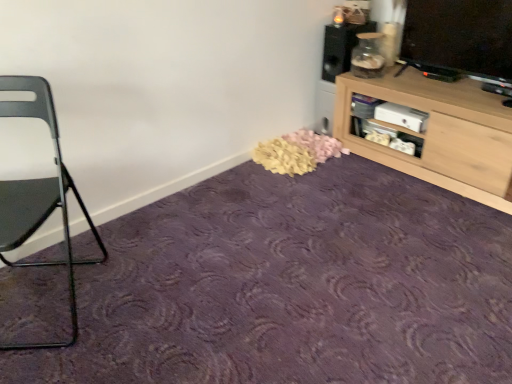
Describe the element at coordinates (294, 286) in the screenshot. The image size is (512, 384). I see `purple carpet at center` at that location.

Image resolution: width=512 pixels, height=384 pixels. Identify the location of matte black speaker at upper right. (341, 47).

Choose the correct answer: Is matte black speaker at upper right inside metallic gray chair at left or outside it?

matte black speaker at upper right is spatially situated outside metallic gray chair at left.

Between matte black speaker at upper right and metallic gray chair at left, which one has smaller size?

matte black speaker at upper right is smaller.

In the image, there is a metallic gray chair at left. Identify the location of speaker above it (from the image's perspective). point(341,47).

From a real-world perspective, is matte black speaker at upper right positioned above or below metallic gray chair at left?

Clearly, from a real-world perspective, matte black speaker at upper right is above metallic gray chair at left.

Is metallic gray chair at left completely or partially outside of purple carpet at center?

That's correct, metallic gray chair at left is outside of purple carpet at center.

Which object is positioned more to the right, metallic gray chair at left or purple carpet at center?

purple carpet at center is more to the right.

What's the angular difference between metallic gray chair at left and purple carpet at center's facing directions?

There is a 128-degree angle between the facing directions of metallic gray chair at left and purple carpet at center.

Which of these two, metallic gray chair at left or purple carpet at center, is bigger?

metallic gray chair at left is bigger.

From a real-world perspective, is metallic gray chair at left positioned over light wood cabinet at upper right based on gravity?

Yes, from a real-world perspective, metallic gray chair at left is above light wood cabinet at upper right.

Find the location of `shelf on the right of metallic gray chair at left`. shelf on the right of metallic gray chair at left is located at coordinates (440, 133).

Does metallic gray chair at left have a lesser width compared to light wood cabinet at upper right?

Indeed, metallic gray chair at left has a lesser width compared to light wood cabinet at upper right.

Is metallic gray chair at left facing away from light wood cabinet at upper right?

No, metallic gray chair at left is not facing the opposite direction of light wood cabinet at upper right.

Is light wood cabinet at upper right not inside matte black speaker at upper right?

Absolutely, light wood cabinet at upper right is external to matte black speaker at upper right.

Can you confirm if light wood cabinet at upper right is shorter than matte black speaker at upper right?

No, light wood cabinet at upper right is not shorter than matte black speaker at upper right.

Considering the sizes of objects light wood cabinet at upper right and matte black speaker at upper right in the image provided, who is bigger, light wood cabinet at upper right or matte black speaker at upper right?

Bigger between the two is light wood cabinet at upper right.

From a real-world perspective, is light wood cabinet at upper right on matte black speaker at upper right?

Incorrect, from a real-world perspective, light wood cabinet at upper right is lower than matte black speaker at upper right.

Which point is more forward, (356, 365) or (498, 120)?

Point (356, 365)

Would you say purple carpet at center is inside or outside light wood cabinet at upper right?

purple carpet at center is not inside light wood cabinet at upper right, it's outside.

In terms of height, does purple carpet at center look taller or shorter compared to light wood cabinet at upper right?

Considering their sizes, purple carpet at center has less height than light wood cabinet at upper right.

Can you tell me how much purple carpet at center and light wood cabinet at upper right differ in facing direction?

They differ by 177 degrees in their facing directions.

Which object is wider, metallic gray chair at left or matte black speaker at upper right?

metallic gray chair at left.

You are a GUI agent. You are given a task and a screenshot of the screen. Output one action in this format:
    pyautogui.click(x=<x>, y=<y>)
    Task: Click on the chair located on the left of matte black speaker at upper right
    
    Given the screenshot: What is the action you would take?
    pyautogui.click(x=39, y=195)

Can you confirm if metallic gray chair at left is positioned to the left of matte black speaker at upper right?

Correct, you'll find metallic gray chair at left to the left of matte black speaker at upper right.

Is metallic gray chair at left oriented towards matte black speaker at upper right?

No.

Is purple carpet at center bigger than matte black speaker at upper right?

Indeed, purple carpet at center has a larger size compared to matte black speaker at upper right.

From a real-world perspective, is purple carpet at center under matte black speaker at upper right?

Correct, in the physical world, purple carpet at center is lower than matte black speaker at upper right.

Considering the sizes of objects purple carpet at center and matte black speaker at upper right in the image provided, who is thinner, purple carpet at center or matte black speaker at upper right?

Thinner between the two is matte black speaker at upper right.

Find the location of a particular element. plain below the matte black speaker at upper right (from the image's perspective) is located at coordinates (294, 286).

What are the coordinates of `speaker lying on the right of metallic gray chair at left` in the screenshot? It's located at (341, 47).

The height and width of the screenshot is (384, 512). Find the location of `chair above the purple carpet at center (from the image's perspective)`. chair above the purple carpet at center (from the image's perspective) is located at coordinates (39, 195).

Which object lies nearer to the anchor point purple carpet at center, metallic gray chair at left or light wood cabinet at upper right?

The object closer to purple carpet at center is metallic gray chair at left.

When comparing their distances from purple carpet at center, does metallic gray chair at left or matte black speaker at upper right seem further?

matte black speaker at upper right lies further to purple carpet at center than the other object.

When comparing their distances from metallic gray chair at left, does purple carpet at center or light wood cabinet at upper right seem further?

light wood cabinet at upper right is further to metallic gray chair at left.

Considering their positions, is matte black speaker at upper right positioned closer to light wood cabinet at upper right than metallic gray chair at left?

Based on the image, matte black speaker at upper right appears to be nearer to light wood cabinet at upper right.

Based on their spatial positions, is matte black speaker at upper right or purple carpet at center further from metallic gray chair at left?

matte black speaker at upper right lies further to metallic gray chair at left than the other object.

Considering their positions, is metallic gray chair at left positioned further to light wood cabinet at upper right than matte black speaker at upper right?

Among the two, metallic gray chair at left is located further to light wood cabinet at upper right.

From the image, which object appears to be nearer to matte black speaker at upper right, light wood cabinet at upper right or metallic gray chair at left?

Among the two, light wood cabinet at upper right is located nearer to matte black speaker at upper right.

Estimate the real-world distances between objects in this image. Which object is further from light wood cabinet at upper right, purple carpet at center or matte black speaker at upper right?

purple carpet at center is further to light wood cabinet at upper right.

This screenshot has width=512, height=384. What are the coordinates of `plain between metallic gray chair at left and light wood cabinet at upper right in the horizontal direction` in the screenshot? It's located at (294, 286).

Locate an element on the screen. This screenshot has height=384, width=512. shelf between purple carpet at center and matte black speaker at upper right in the front-back direction is located at coordinates (440, 133).

At what (x,y) coordinates should I click in order to perform the action: click on speaker between metallic gray chair at left and light wood cabinet at upper right from left to right. Please return your answer as a coordinate pair (x, y). Image resolution: width=512 pixels, height=384 pixels. Looking at the image, I should click on (341, 47).

Image resolution: width=512 pixels, height=384 pixels. Identify the location of chair located between purple carpet at center and matte black speaker at upper right in the depth direction. (39, 195).